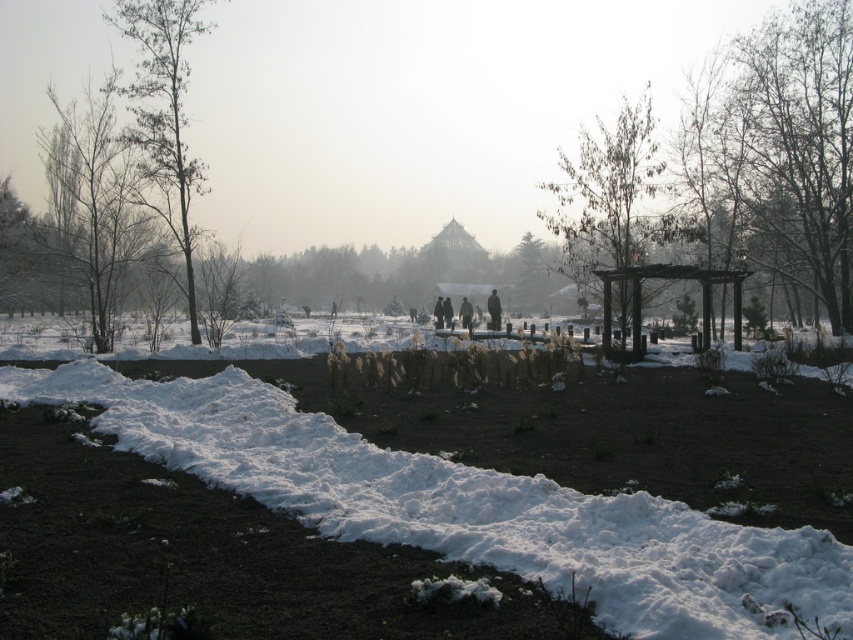
Is point (637, 125) farther from camera compared to point (173, 128)?

No, (637, 125) is in front of (173, 128).

Identify the location of green matte tree at center. The image size is (853, 640). (606, 205).

Does white fluffy snow at lower left appear over snow-covered tree at left?

No.

How distant is white fluffy snow at lower left from snow-covered tree at left?

white fluffy snow at lower left and snow-covered tree at left are 15.43 meters apart.

The width and height of the screenshot is (853, 640). I want to click on white fluffy snow at lower left, so click(x=466, y=506).

Measure the distance between snow-covered tree at left and camera.

snow-covered tree at left is 23.41 meters from camera.

Does snow-covered tree at left have a larger size compared to bare wood tree at left?

Actually, snow-covered tree at left might be smaller than bare wood tree at left.

Is point (73, 225) farther from camera compared to point (181, 54)?

No, it is in front of (181, 54).

Identify the location of snow-covered tree at left. This screenshot has width=853, height=640. (93, 202).